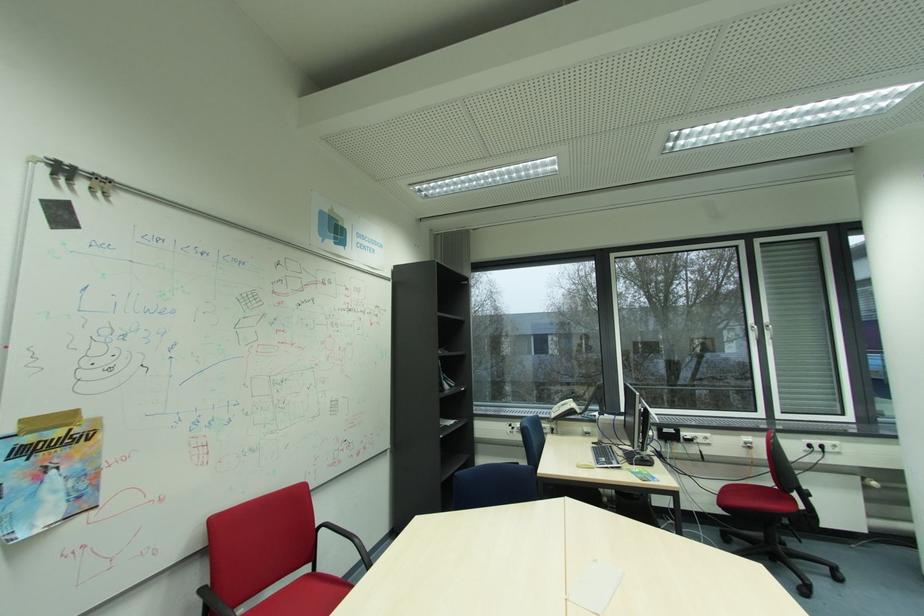
This screenshot has height=616, width=924. What are the coordinates of `paper poster` in the screenshot? It's located at (49, 472).